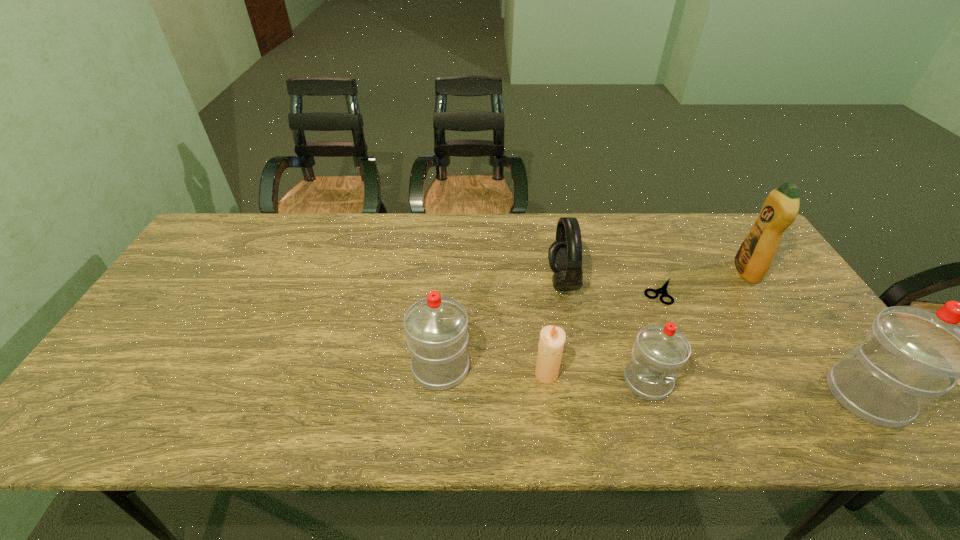
You are a GUI agent. You are given a task and a screenshot of the screen. Output one action in this format:
    pyautogui.click(x=<x>, y=<y>)
    Task: Click on the free region located 0.230m on the label of the detergent
    The image size is (960, 540).
    Given the screenshot: What is the action you would take?
    pyautogui.click(x=659, y=272)

Where is `vacant space located 0.360m on the label of the detergent`? The image size is (960, 540). vacant space located 0.360m on the label of the detergent is located at coordinates (615, 272).

Find the location of a particular element. vacant space located on the left of the fifth object from left to right is located at coordinates (612, 292).

Where is `free region located 0.360m on the right of the second object from left to right`? free region located 0.360m on the right of the second object from left to right is located at coordinates point(708,374).

Find the location of a particular element. This screenshot has height=540, width=960. object that is at the far edge is located at coordinates coord(753,259).

Where is `candle at the near edge`? The image size is (960, 540). candle at the near edge is located at coordinates pos(552,338).

The height and width of the screenshot is (540, 960). I want to click on water bottle located in the right edge section of the desktop, so click(912, 355).

Locate an element on the screen. The width and height of the screenshot is (960, 540). detergent that is at the right edge is located at coordinates (753, 259).

Locate an element on the screen. Image resolution: width=960 pixels, height=540 pixels. object that is at the far right corner is located at coordinates (753, 259).

Where is `object present at the near right corner`? The width and height of the screenshot is (960, 540). object present at the near right corner is located at coordinates (912, 355).